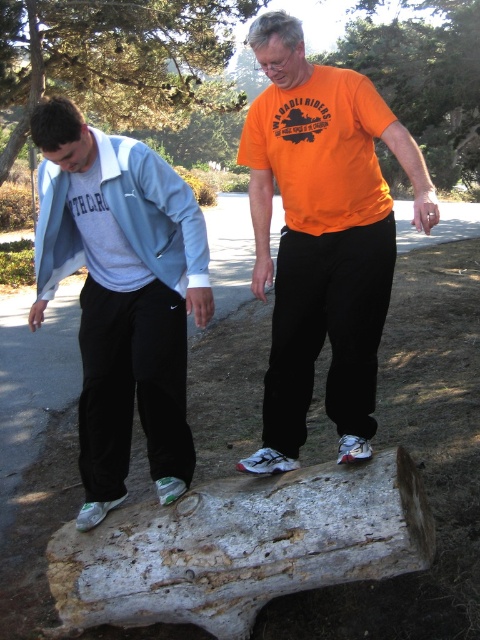
Question: Is orange matte t-shirt at center above matte gray jacket at left?

Choices:
 (A) no
 (B) yes

Answer: (B)

Question: Which point is farther to the camera?

Choices:
 (A) matte gray jacket at left
 (B) orange matte t-shirt at center

Answer: (A)

Question: Does orange matte t-shirt at center have a greater width compared to matte gray jacket at left?

Choices:
 (A) yes
 (B) no

Answer: (A)

Question: Which object is farther from the camera taking this photo?

Choices:
 (A) matte gray jacket at left
 (B) orange matte t-shirt at center

Answer: (A)

Question: Among these objects, which one is nearest to the camera?

Choices:
 (A) matte gray jacket at left
 (B) orange matte t-shirt at center

Answer: (B)

Question: Is the position of orange matte t-shirt at center more distant than that of matte gray jacket at left?

Choices:
 (A) yes
 (B) no

Answer: (B)